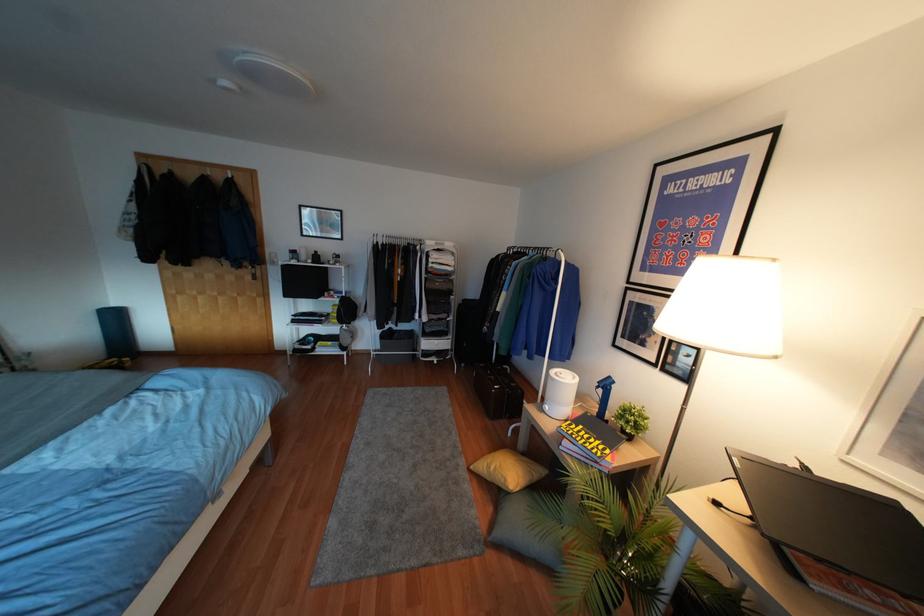
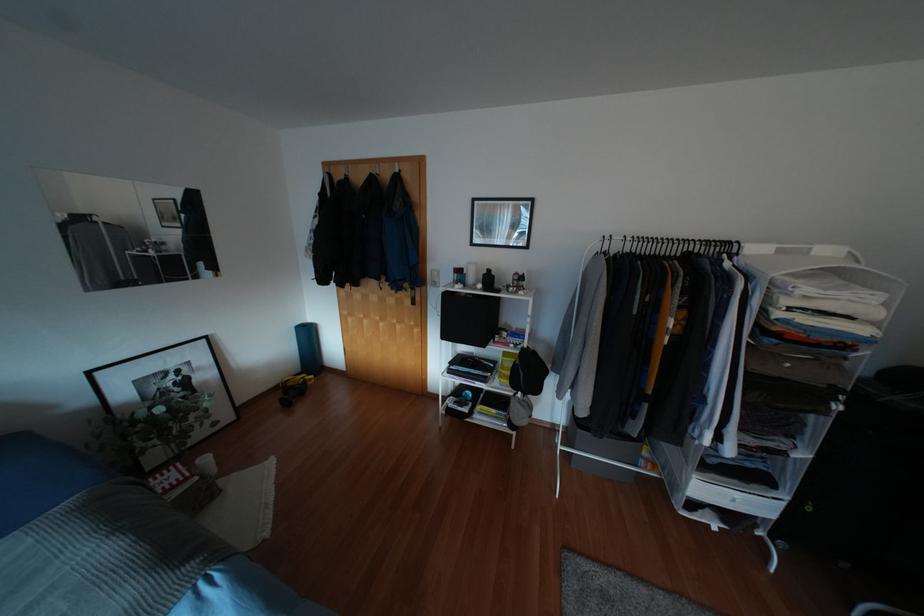
Find the pixel in the second image that matches point 435,243 in the first image.

(779, 251)